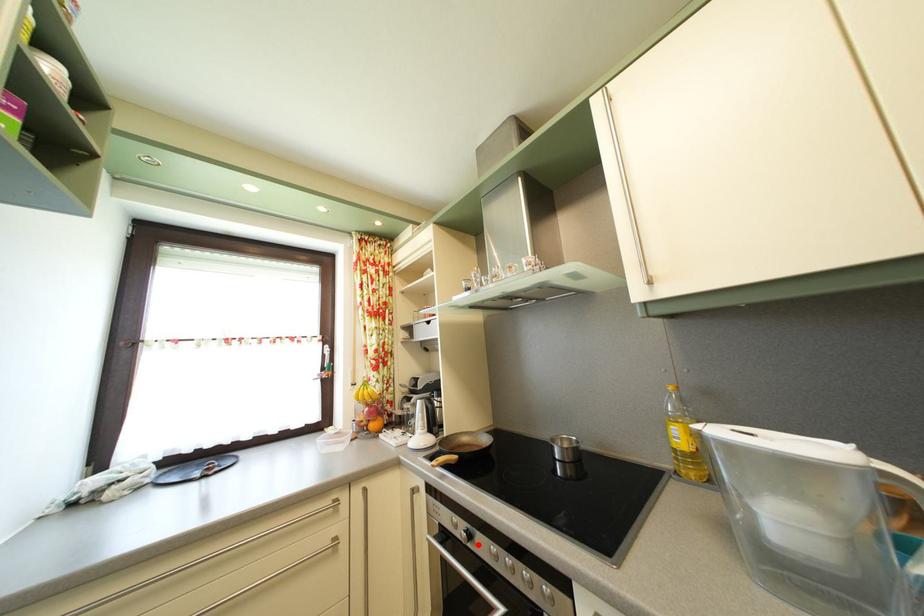
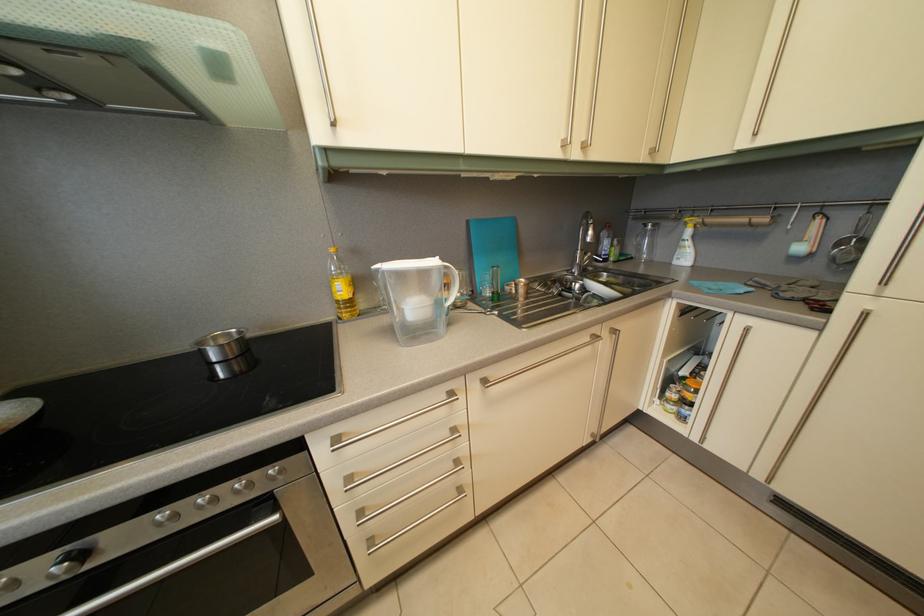
Question: I am providing you with two images of the same scene from different viewpoints. Image1 has a red point marked. In image2, the corresponding 3D location appears at what relative position? Reply with the corresponding letter.

Choices:
 (A) Closer
 (B) Farther

Answer: (A)